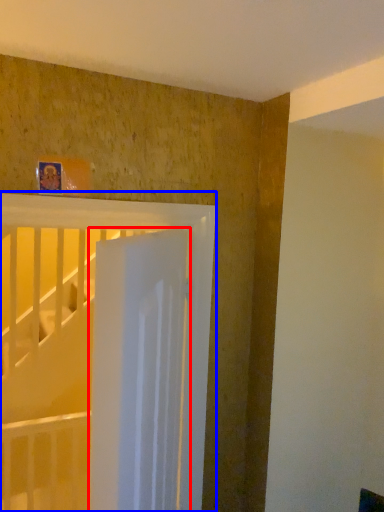
Question: Which object is closer to the camera taking this photo, door (highlighted by a red box) or bed (highlighted by a blue box)?

Choices:
 (A) door
 (B) bed

Answer: (A)